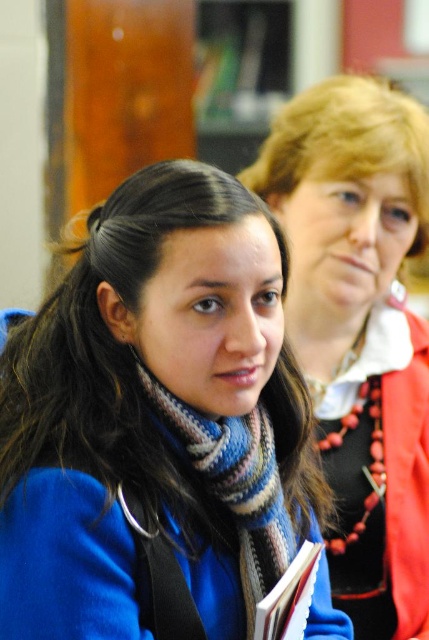
You are organizing a fashion show and need to display two scarves side by side. The blue woolen scarf at center and the knitted wool scarf at center. Which scarf is wider?

The blue woolen scarf at center is wider than the knitted wool scarf at center, so it will occupy more space when displayed side by side.

Based on the photo, you are a fashion designer observing the two items in the image. You need to determine which item is taller between the matte black jacket at upper right and the knitted wool scarf at center. Which one is taller?

The matte black jacket at upper right has a greater height compared to the knitted wool scarf at center, so the matte black jacket at upper right is taller.